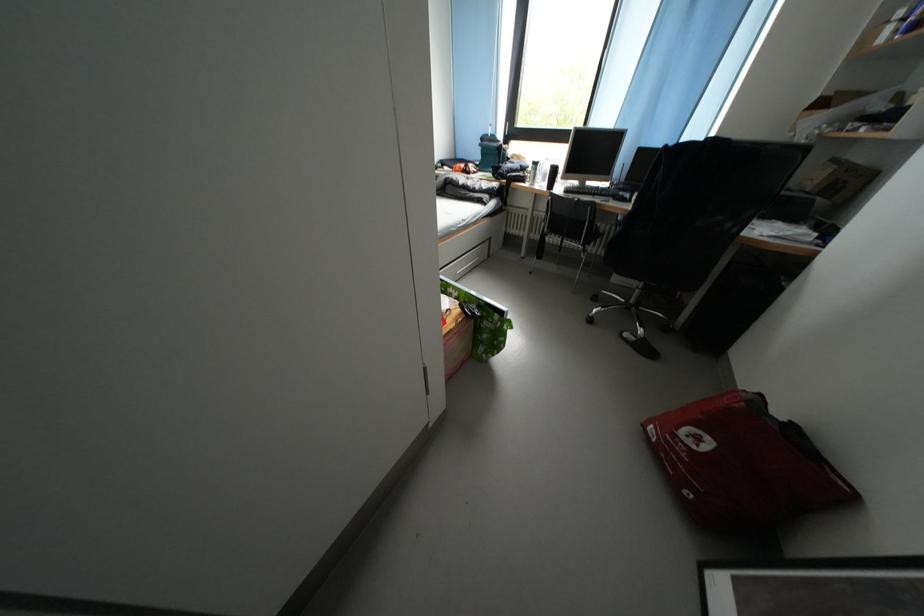
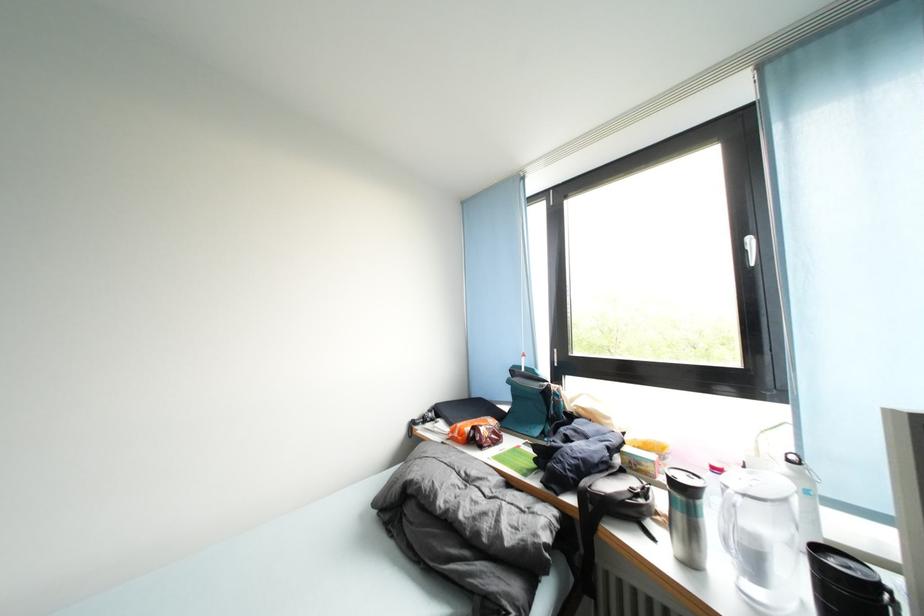
Locate, in the second image, the point that corresponds to (x=473, y=177) in the first image.

(482, 446)